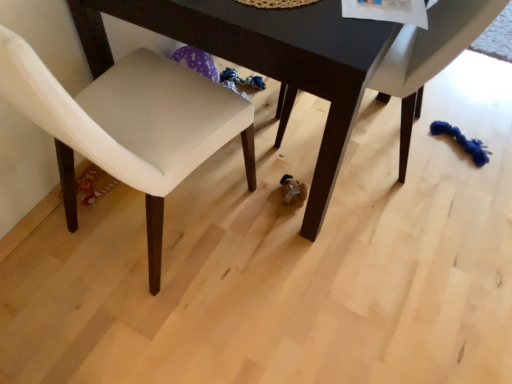
Question: From a real-world perspective, does white leather chair at lower left, the 2th chair in the right-to-left sequence, sit lower than white fabric chair at lower right, which is the 1th chair in right-to-left order?

Choices:
 (A) yes
 (B) no

Answer: (B)

Question: From the image's perspective, would you say white leather chair at lower left, which is counted as the first chair, starting from the left, is shown under white fabric chair at lower right, which is the 1th chair in right-to-left order?

Choices:
 (A) yes
 (B) no

Answer: (A)

Question: Does white leather chair at lower left, the 2th chair in the right-to-left sequence, come behind white fabric chair at lower right, which is counted as the 2th chair, starting from the left?

Choices:
 (A) no
 (B) yes

Answer: (A)

Question: Is white leather chair at lower left, which is counted as the first chair, starting from the left, smaller than white fabric chair at lower right, which is the 1th chair in right-to-left order?

Choices:
 (A) yes
 (B) no

Answer: (B)

Question: Is white leather chair at lower left, which is counted as the first chair, starting from the left, far away from white fabric chair at lower right, which is counted as the 2th chair, starting from the left?

Choices:
 (A) yes
 (B) no

Answer: (B)

Question: Based on their sizes in the image, would you say white leather chair at lower left, the 2th chair in the right-to-left sequence, is bigger or smaller than dark wood table at center?

Choices:
 (A) small
 (B) big

Answer: (A)

Question: Based on their positions, is white leather chair at lower left, which is counted as the first chair, starting from the left, located to the left or right of dark wood table at center?

Choices:
 (A) left
 (B) right

Answer: (A)

Question: Considering their positions, is white leather chair at lower left, which is counted as the first chair, starting from the left, located in front of or behind dark wood table at center?

Choices:
 (A) behind
 (B) front

Answer: (B)

Question: Considering the positions of white leather chair at lower left, which is counted as the first chair, starting from the left, and dark wood table at center in the image, is white leather chair at lower left, which is counted as the first chair, starting from the left, taller or shorter than dark wood table at center?

Choices:
 (A) tall
 (B) short

Answer: (A)

Question: Choose the correct answer: Is dark wood table at center inside white leather chair at lower left, which is counted as the first chair, starting from the left, or outside it?

Choices:
 (A) inside
 (B) outside

Answer: (B)

Question: Is point (122, 6) closer or farther from the camera than point (78, 94)?

Choices:
 (A) farther
 (B) closer

Answer: (B)

Question: Considering the positions of dark wood table at center and white leather chair at lower left, which is counted as the first chair, starting from the left, in the image, is dark wood table at center bigger or smaller than white leather chair at lower left, which is counted as the first chair, starting from the left,?

Choices:
 (A) small
 (B) big

Answer: (B)

Question: Visually, is dark wood table at center positioned to the left or to the right of white leather chair at lower left, which is counted as the first chair, starting from the left?

Choices:
 (A) right
 (B) left

Answer: (A)

Question: Based on their positions, is dark wood table at center located to the left or right of white fabric chair at lower right, which is the 1th chair in right-to-left order?

Choices:
 (A) left
 (B) right

Answer: (A)

Question: Considering the positions of dark wood table at center and white fabric chair at lower right, which is the 1th chair in right-to-left order, in the image, is dark wood table at center bigger or smaller than white fabric chair at lower right, which is the 1th chair in right-to-left order,?

Choices:
 (A) big
 (B) small

Answer: (A)